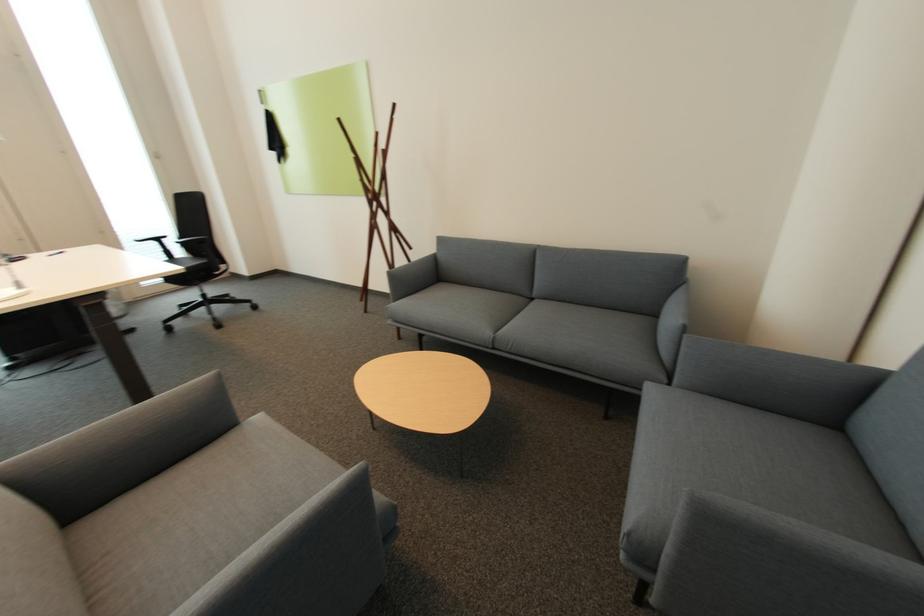
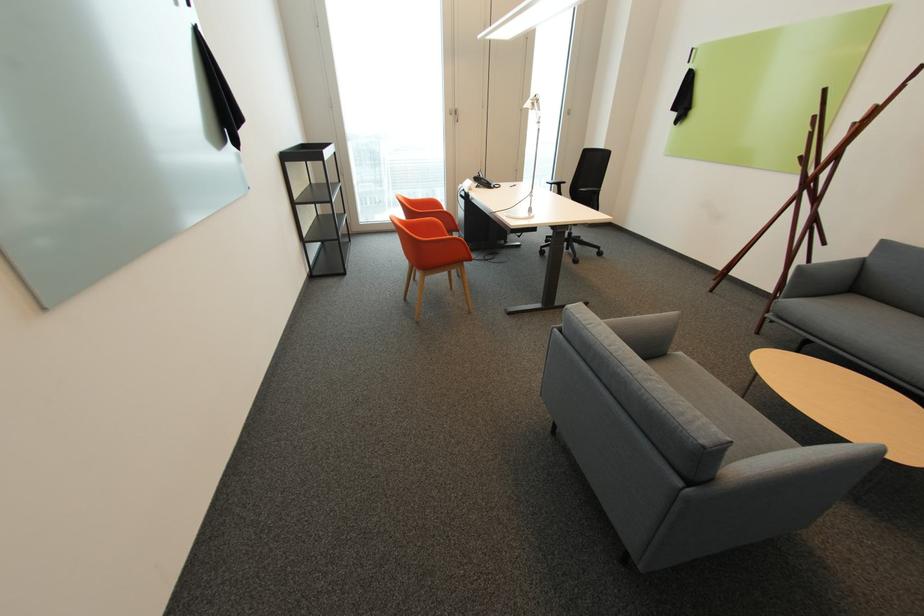
Question: I am providing you with two images of the same scene from different viewpoints. After the viewpoint changes to image2, which objects are now occluded?

Choices:
 (A) chair armrest
 (B) grey sofa armrest
 (C) orange chair sitting surface
 (D) blue circular case

Answer: (A)